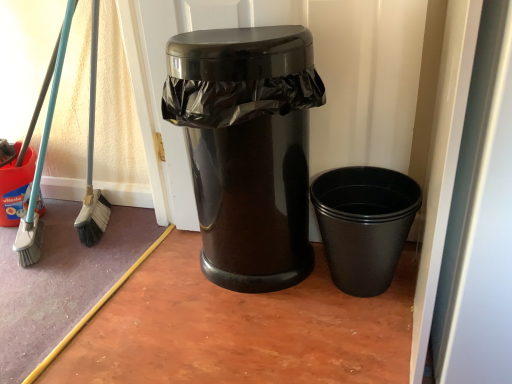
Question: Considering the positions of black plastic cup at lower right, positioned as the 1th waste container in right-to-left order, and glossy black trash can at center, the 1th waste container in the left-to-right sequence, in the image, is black plastic cup at lower right, positioned as the 1th waste container in right-to-left order, bigger or smaller than glossy black trash can at center, the 1th waste container in the left-to-right sequence,?

Choices:
 (A) big
 (B) small

Answer: (B)

Question: Is point (327, 221) positioned closer to the camera than point (204, 51)?

Choices:
 (A) farther
 (B) closer

Answer: (A)

Question: Which object is the closest to the black plastic cup at lower right, acting as the 2th waste container starting from the left?

Choices:
 (A) glossy black trash can at center, arranged as the second waste container when viewed from the right
 (B) glossy plastic trash can at center

Answer: (A)

Question: Based on their relative distances, which object is farther from the glossy black trash can at center, arranged as the second waste container when viewed from the right?

Choices:
 (A) glossy plastic trash can at center
 (B) black plastic cup at lower right, acting as the 2th waste container starting from the left

Answer: (B)